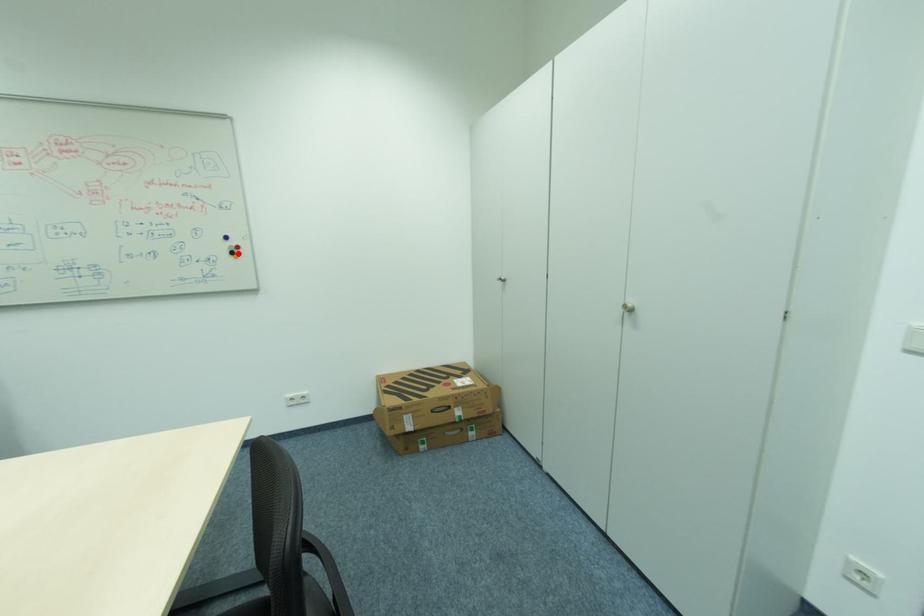
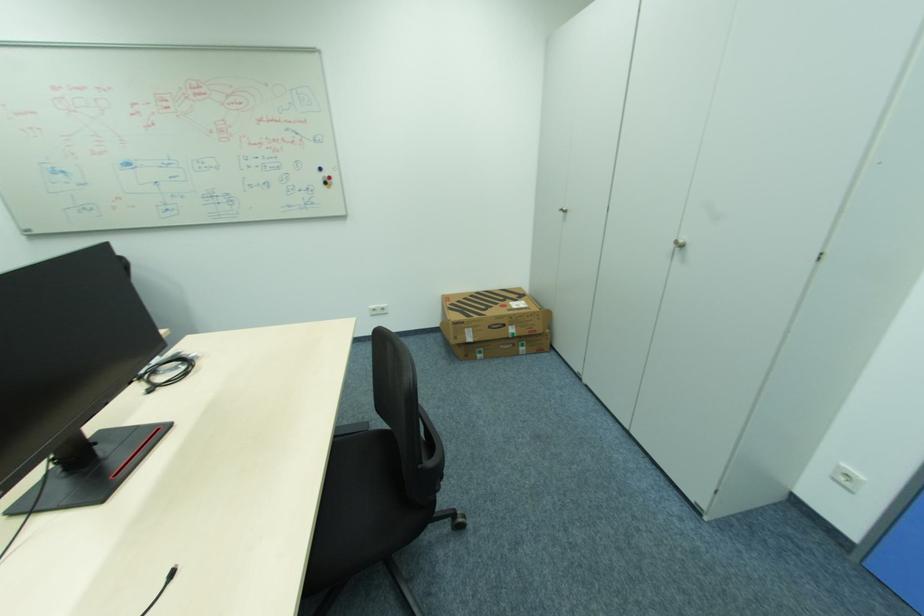
Question: I am providing you with two images of the same scene from different viewpoints. In image1, a red point is highlighted. Considering the same 3D point in image2, which of the following is correct?

Choices:
 (A) It is closer
 (B) It is farther

Answer: (A)